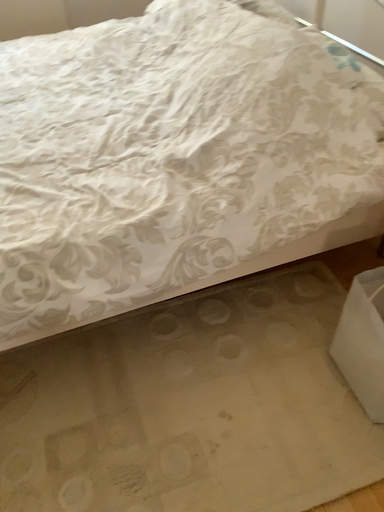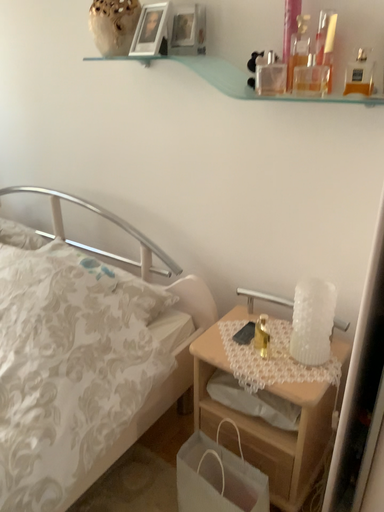
Question: How did the camera likely rotate when shooting the video?

Choices:
 (A) rotated downward
 (B) rotated upward

Answer: (B)